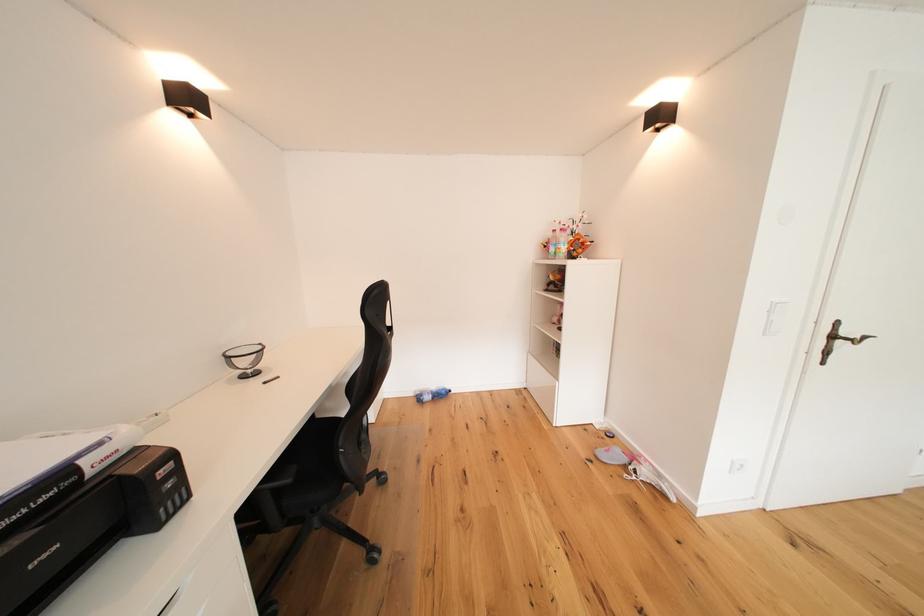
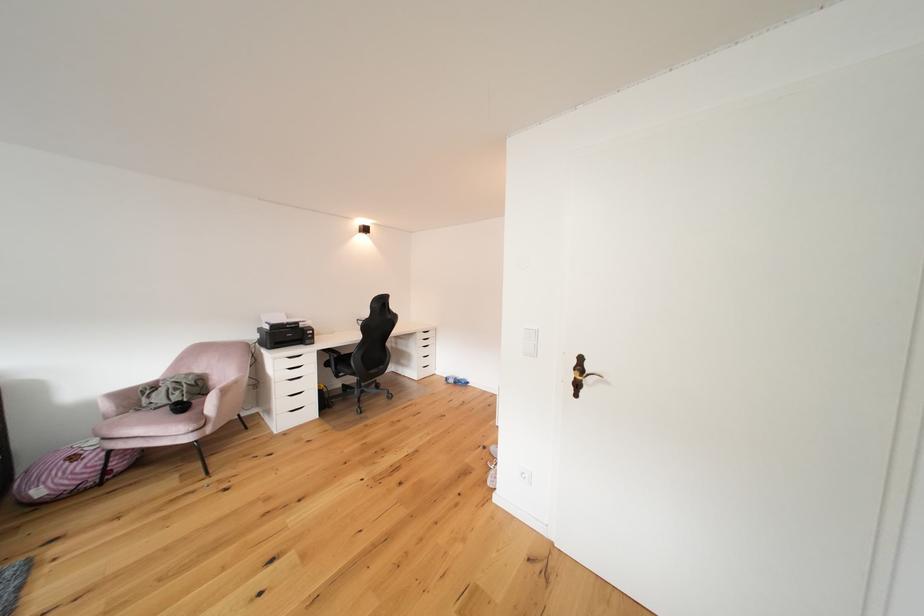
The point at (429,402) is marked in the first image. Where is the corresponding point in the second image?

(456, 383)